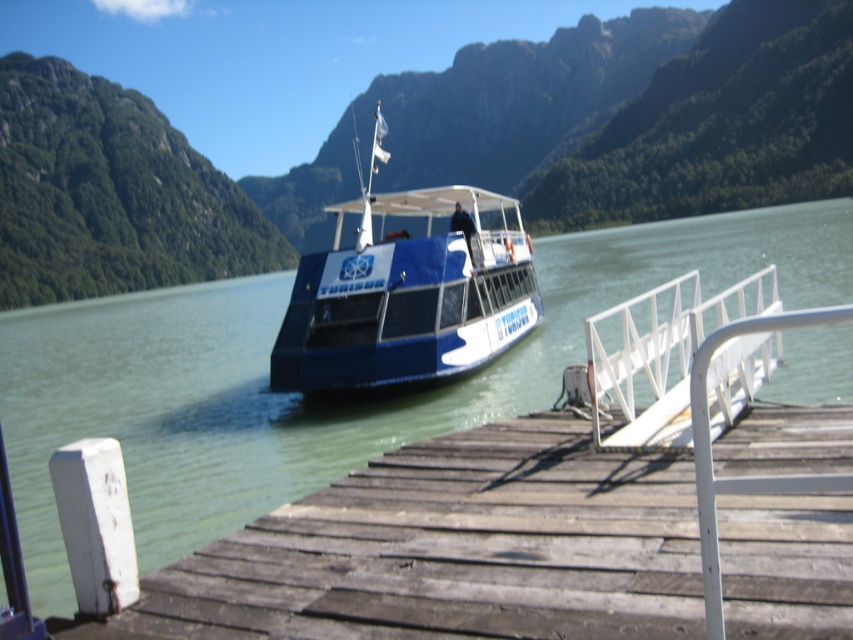
You are a tour guide preparing to board the blue glossy boat at center. You notice the white matte rail at center nearby. Which object is bigger in size?

The blue glossy boat at center has a larger size compared to the white matte rail at center.

Looking at this image, you are a photographer standing on the wooden pier and want to take a photo of the blue glossy boat at center and the white matte rail at center. Which object will appear larger in your photo?

The blue glossy boat at center will appear larger in the photo because it is closer to the photographer than the white matte rail at center.

You are a passenger on the blue polished wood boat at center and want to disembark onto the white matte rail at center. Can you step directly from the boat to the rail without needing a ladder or stairs?

The blue polished wood boat at center is above the white matte rail at center, so you can step directly from the boat to the rail without needing a ladder or stairs since the boat is positioned higher.